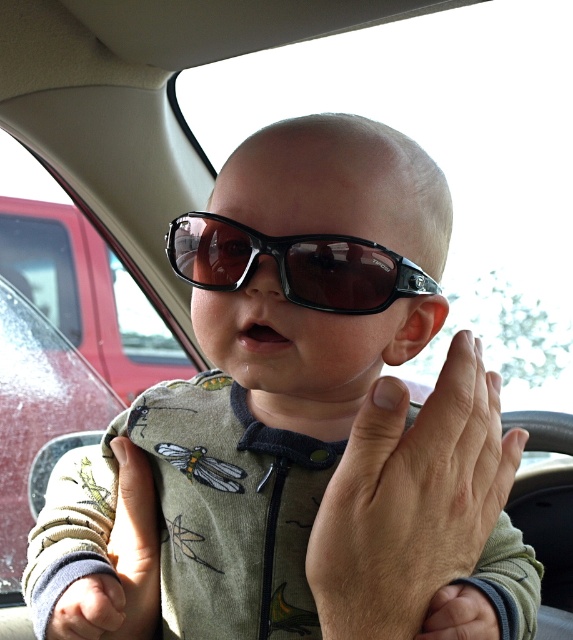
You are a GPS system in the car. You need to guide the driver to the nearest hospital. The driver says, I want to keep my hand on the smooth skin hand at center while driving. Is this possible?

The smooth skin hand at center is located at coordinates (414,508), which is near the baby in the car seat. The driver should keep both hands on the steering wheel for safety. Moving a hand away to place it on the smooth skin hand at center is not advisable and could be dangerous.

You are a safety inspector checking the car seat for proper installation. You notice two hands in the image, the smooth skin hand at center and the soft beige fabric hand at lower left. Which hand is closer to the right side of the car seat?

The smooth skin hand at center is positioned on the right side of the soft beige fabric hand at lower left, so it is closer to the right side of the car seat.

You are a safety inspector checking the car seat setup. The matte black sunglasses at center are blocking the baby driver camera. To avoid obstruction, you need to move the sunglasses so that they are at least 15 centimeters away from the soft beige fabric hand at lower left. Is the current distance sufficient?

The distance between the matte black sunglasses at center and the soft beige fabric hand at lower left is 12.61 centimeters, which is less than the required 15 centimeters. Therefore, the sunglasses are too close and need to be moved further away to comply with the safety requirement.